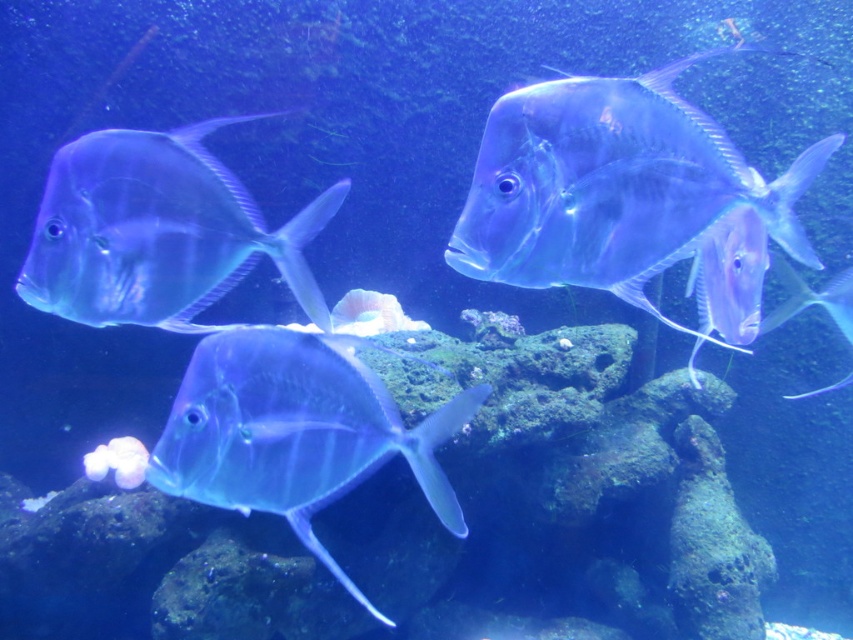
Question: Can you confirm if translucent glass fish at upper center is positioned below translucent blue fish at left?

Choices:
 (A) no
 (B) yes

Answer: (A)

Question: Among these points, which one is farthest from the camera?

Choices:
 (A) 780,320
 (B) 724,163

Answer: (A)

Question: Which object is positioned closest to the translucent glassy fish at right?

Choices:
 (A) translucent glass fish at upper center
 (B) translucent blue fish at left
 (C) translucent glass fish at center

Answer: (A)

Question: Which point is closer to the camera?

Choices:
 (A) translucent blue fish at left
 (B) translucent glassy fish at right
 (C) translucent glass fish at center

Answer: (C)

Question: Is translucent blue fish at left closer to the viewer compared to translucent glassy fish at right?

Choices:
 (A) yes
 (B) no

Answer: (A)

Question: Where is translucent glass fish at upper center located in relation to translucent glass fish at center in the image?

Choices:
 (A) above
 (B) below

Answer: (A)